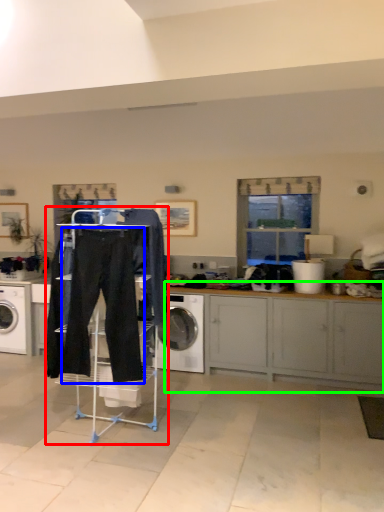
Question: Based on their relative distances, which object is nearer to closet (highlighted by a red box)? Choose from sweat pant (highlighted by a blue box) and cabinetry (highlighted by a green box).

Choices:
 (A) sweat pant
 (B) cabinetry

Answer: (A)